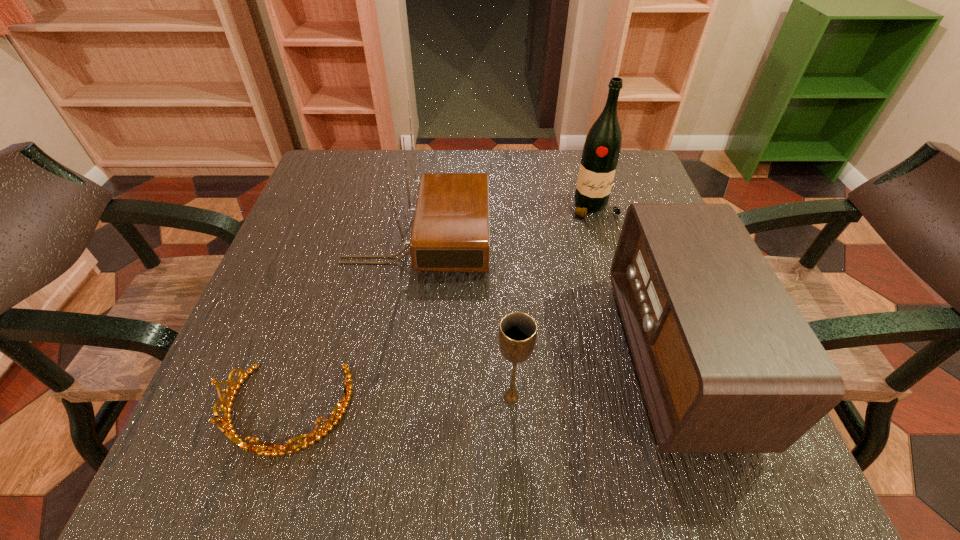
Locate an element on the screen. The height and width of the screenshot is (540, 960). wine bottle is located at coordinates (601, 151).

The height and width of the screenshot is (540, 960). What are the coordinates of `the second tallest object` in the screenshot? It's located at (450, 232).

Locate an element on the screen. Image resolution: width=960 pixels, height=540 pixels. the left radio receiver is located at coordinates (450, 232).

I want to click on the shorter radio receiver, so click(727, 363).

You are a GUI agent. You are given a task and a screenshot of the screen. Output one action in this format:
    pyautogui.click(x=<x>, y=<y>)
    Task: Click on the third object from left to right
    
    Given the screenshot: What is the action you would take?
    pyautogui.click(x=517, y=331)

Find the location of `the shortest object`. the shortest object is located at coordinates (273, 449).

You are a GUI agent. You are given a task and a screenshot of the screen. Output one action in this format:
    pyautogui.click(x=<x>, y=<y>)
    Task: Click on the free point located on the surface of the tallest object
    
    Given the screenshot: What is the action you would take?
    pyautogui.click(x=626, y=317)

You are a GUI agent. You are given a task and a screenshot of the screen. Output one action in this format:
    pyautogui.click(x=<x>, y=<y>)
    Task: Click on the free region located 0.100m on the front panel of the left radio receiver
    
    Given the screenshot: What is the action you would take?
    pyautogui.click(x=536, y=239)

Where is `vacant space located on the front-facing side of the shorter radio receiver`? Image resolution: width=960 pixels, height=540 pixels. vacant space located on the front-facing side of the shorter radio receiver is located at coordinates (448, 356).

Where is `free space located on the front-facing side of the shorter radio receiver`? The height and width of the screenshot is (540, 960). free space located on the front-facing side of the shorter radio receiver is located at coordinates (437, 356).